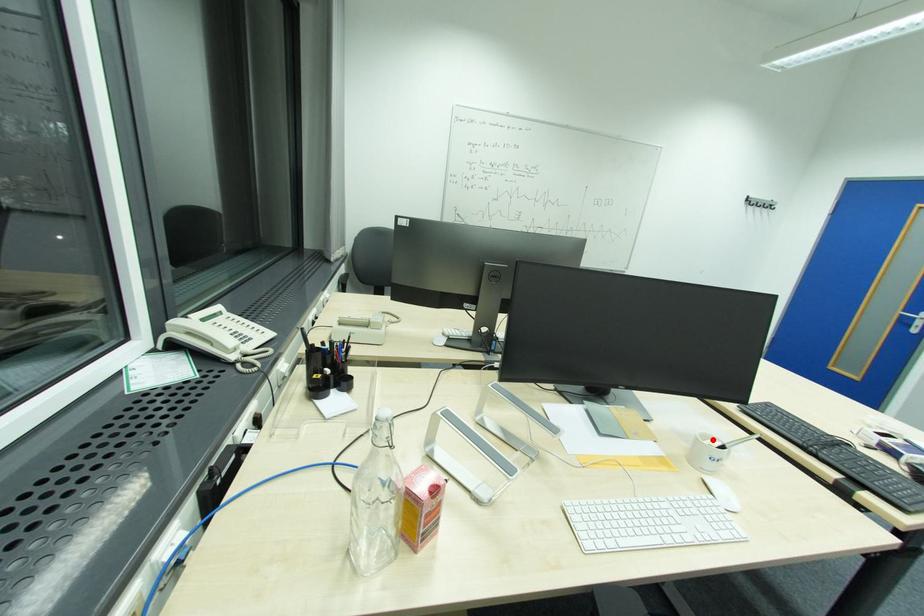
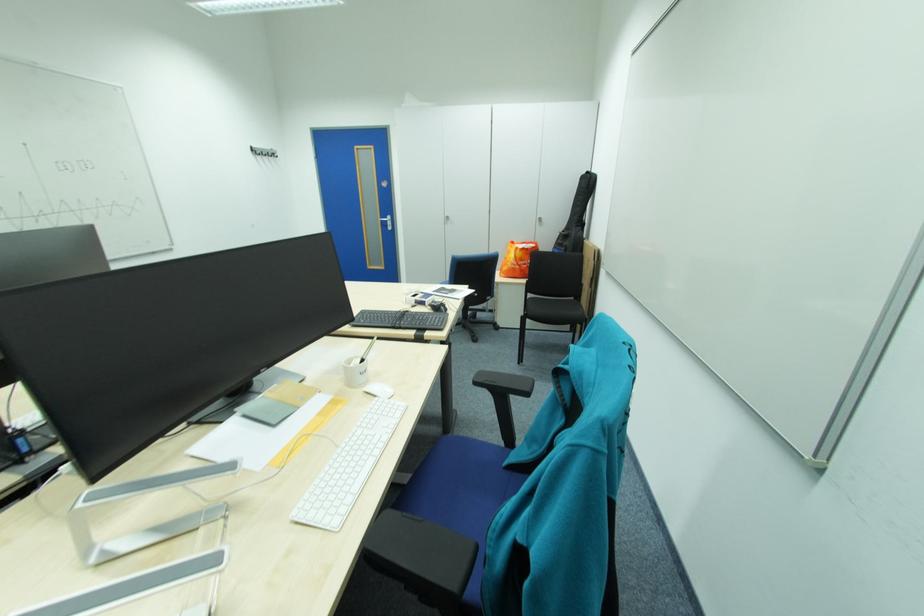
In the second image, find the point that corresponds to the highlighted location in the first image.

(359, 363)